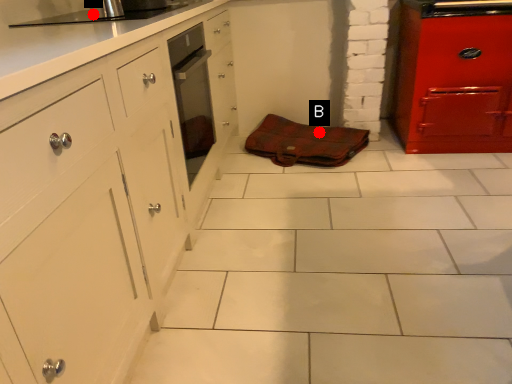
Question: Two points are circled on the image, labeled by A and B beside each circle. Among these points, which one is farthest from the camera?

Choices:
 (A) A is further
 (B) B is further

Answer: (B)